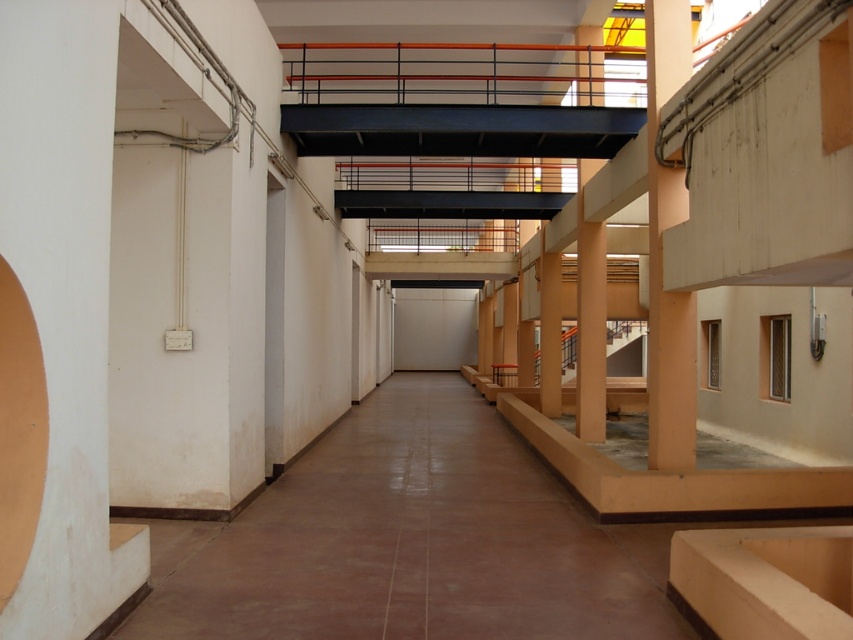
You are a maintenance worker inspecting the orange matte pillar at right and the orange matte column at center in the corridor. Which of the two has a larger diameter?

The orange matte column at center has a larger diameter than the orange matte pillar at right.